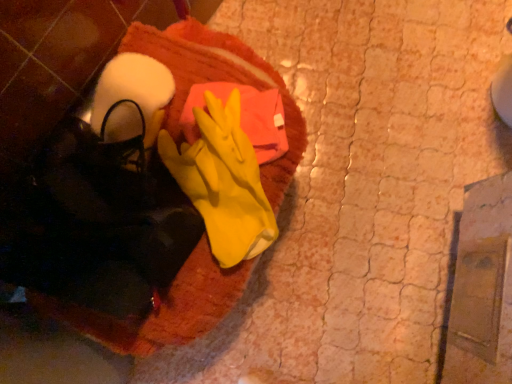
Question: Is the position of yellow rubber glove at center more distant than that of orange towel at center?

Choices:
 (A) yes
 (B) no

Answer: (B)

Question: Is yellow rubber glove at center directly adjacent to orange towel at center?

Choices:
 (A) yes
 (B) no

Answer: (A)

Question: Is the position of yellow rubber glove at center less distant than that of orange towel at center?

Choices:
 (A) yes
 (B) no

Answer: (A)

Question: Considering the relative sizes of yellow rubber glove at center and orange towel at center in the image provided, is yellow rubber glove at center shorter than orange towel at center?

Choices:
 (A) yes
 (B) no

Answer: (A)

Question: Is orange towel at center located within yellow rubber glove at center?

Choices:
 (A) no
 (B) yes

Answer: (A)

Question: Is yellow rubber glove at center bigger than orange towel at center?

Choices:
 (A) no
 (B) yes

Answer: (A)

Question: Is orange towel at center shorter than yellow rubber glove at center?

Choices:
 (A) yes
 (B) no

Answer: (B)

Question: Does orange towel at center have a greater height compared to yellow rubber glove at center?

Choices:
 (A) yes
 (B) no

Answer: (A)

Question: Is orange towel at center turned away from yellow rubber glove at center?

Choices:
 (A) yes
 (B) no

Answer: (B)

Question: Can you confirm if orange towel at center is positioned to the right of yellow rubber glove at center?

Choices:
 (A) no
 (B) yes

Answer: (A)

Question: Is orange towel at center further to camera compared to yellow rubber glove at center?

Choices:
 (A) no
 (B) yes

Answer: (B)

Question: Is orange towel at center not close to yellow rubber glove at center?

Choices:
 (A) yes
 (B) no

Answer: (B)

Question: Is point (225, 107) closer or farther from the camera than point (210, 324)?

Choices:
 (A) farther
 (B) closer

Answer: (B)